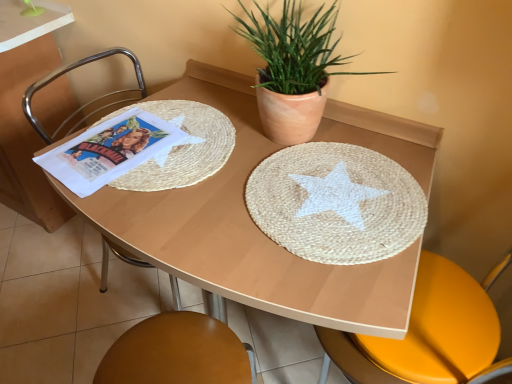
Question: Could you tell me if natural fiber placemat at center is turned towards terracotta clay pot at upper center?

Choices:
 (A) no
 (B) yes

Answer: (A)

Question: Is natural fiber placemat at center shorter than terracotta clay pot at upper center?

Choices:
 (A) yes
 (B) no

Answer: (A)

Question: Is natural fiber placemat at center smaller than terracotta clay pot at upper center?

Choices:
 (A) no
 (B) yes

Answer: (B)

Question: From the image's perspective, is natural fiber placemat at center on top of terracotta clay pot at upper center?

Choices:
 (A) yes
 (B) no

Answer: (B)

Question: Is natural fiber placemat at center completely or partially outside of terracotta clay pot at upper center?

Choices:
 (A) yes
 (B) no

Answer: (A)

Question: Relative to terracotta clay pot at upper center, is white paper comic book at left in front or behind?

Choices:
 (A) behind
 (B) front

Answer: (A)

Question: In terms of height, does white paper comic book at left look taller or shorter compared to terracotta clay pot at upper center?

Choices:
 (A) short
 (B) tall

Answer: (A)

Question: Is white paper comic book at left wider or thinner than terracotta clay pot at upper center?

Choices:
 (A) wide
 (B) thin

Answer: (A)

Question: Considering the relative positions of white paper comic book at left and terracotta clay pot at upper center in the image provided, is white paper comic book at left to the left or to the right of terracotta clay pot at upper center?

Choices:
 (A) left
 (B) right

Answer: (A)

Question: Is brushed metal chair at left in front of or behind terracotta clay pot at upper center in the image?

Choices:
 (A) front
 (B) behind

Answer: (B)

Question: Considering the relative positions of brushed metal chair at left and terracotta clay pot at upper center in the image provided, is brushed metal chair at left to the left or to the right of terracotta clay pot at upper center?

Choices:
 (A) left
 (B) right

Answer: (A)

Question: From the image's perspective, is brushed metal chair at left positioned above or below terracotta clay pot at upper center?

Choices:
 (A) below
 (B) above

Answer: (A)

Question: In terms of height, does brushed metal chair at left look taller or shorter compared to terracotta clay pot at upper center?

Choices:
 (A) tall
 (B) short

Answer: (A)

Question: Is terracotta clay pot at upper center spatially inside natural fiber placemat at center, or outside of it?

Choices:
 (A) inside
 (B) outside

Answer: (B)

Question: From the image's perspective, is terracotta clay pot at upper center positioned above or below natural fiber placemat at center?

Choices:
 (A) above
 (B) below

Answer: (A)